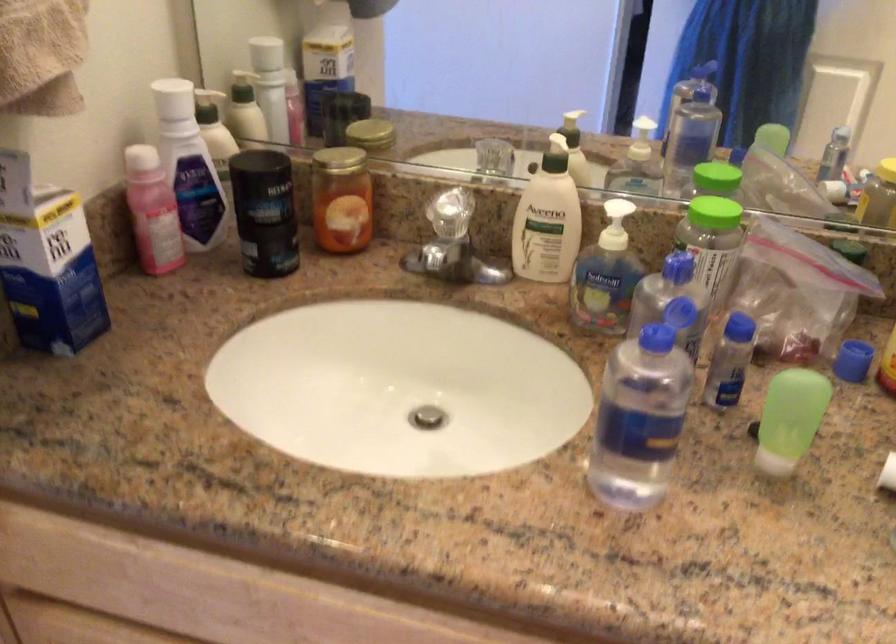
What do you see at coordinates (152, 211) in the screenshot? Image resolution: width=896 pixels, height=644 pixels. I see `the pink bottle` at bounding box center [152, 211].